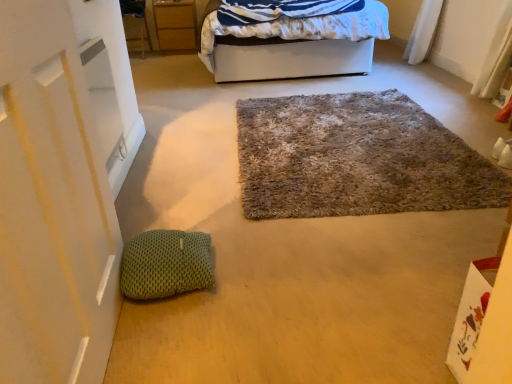
Question: Are white fabric bed at upper center and fuzzy carpet at center located far from each other?

Choices:
 (A) yes
 (B) no

Answer: (A)

Question: Could you tell me if white fabric bed at upper center is turned towards fuzzy carpet at center?

Choices:
 (A) yes
 (B) no

Answer: (A)

Question: Considering the relative sizes of white fabric bed at upper center and fuzzy carpet at center in the image provided, is white fabric bed at upper center wider than fuzzy carpet at center?

Choices:
 (A) yes
 (B) no

Answer: (A)

Question: From a real-world perspective, does white fabric bed at upper center stand above fuzzy carpet at center?

Choices:
 (A) yes
 (B) no

Answer: (A)

Question: Is white fabric bed at upper center outside fuzzy carpet at center?

Choices:
 (A) no
 (B) yes

Answer: (B)

Question: Does white fabric bed at upper center have a larger size compared to fuzzy carpet at center?

Choices:
 (A) no
 (B) yes

Answer: (B)

Question: Does green knitted pillow at lower left turn towards fuzzy carpet at center?

Choices:
 (A) yes
 (B) no

Answer: (B)

Question: Is green knitted pillow at lower left at the right side of fuzzy carpet at center?

Choices:
 (A) yes
 (B) no

Answer: (B)

Question: Is there a large distance between green knitted pillow at lower left and fuzzy carpet at center?

Choices:
 (A) yes
 (B) no

Answer: (B)

Question: Can you confirm if green knitted pillow at lower left is shorter than fuzzy carpet at center?

Choices:
 (A) no
 (B) yes

Answer: (A)

Question: Does green knitted pillow at lower left lie in front of fuzzy carpet at center?

Choices:
 (A) no
 (B) yes

Answer: (B)

Question: From the image's perspective, is green knitted pillow at lower left located beneath fuzzy carpet at center?

Choices:
 (A) yes
 (B) no

Answer: (A)

Question: Does white fabric bed at upper center appear on the left side of matte wood cabinet at upper left?

Choices:
 (A) no
 (B) yes

Answer: (A)